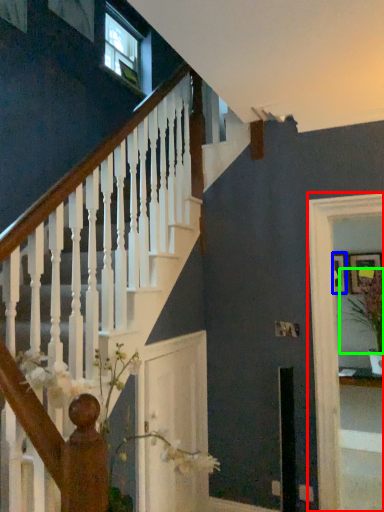
Question: Based on their relative distances, which object is farther from glass door (highlighted by a red box)? Choose from picture frame (highlighted by a blue box) and plant (highlighted by a green box).

Choices:
 (A) picture frame
 (B) plant

Answer: (A)